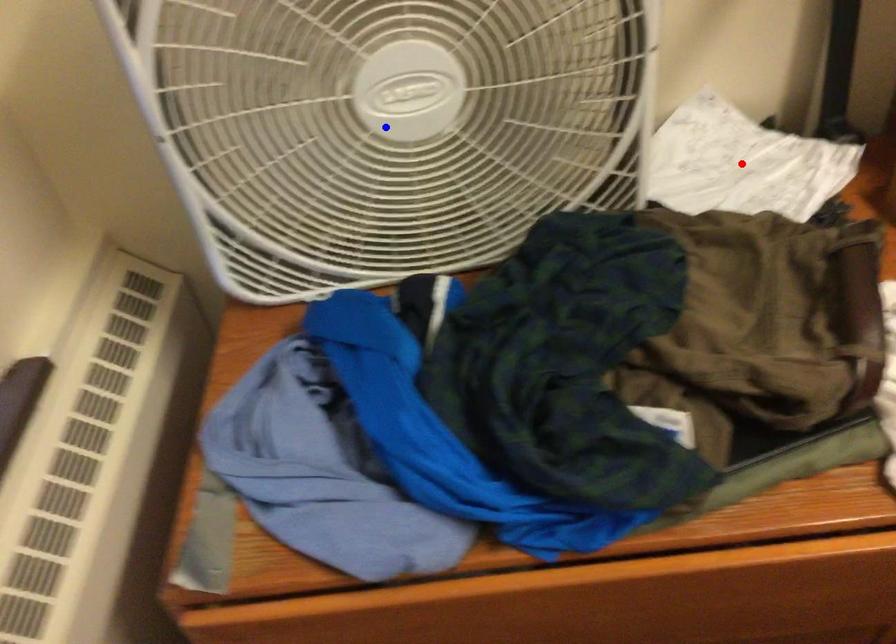
Question: Which of the two points in the image is closer to the camera?

Choices:
 (A) Blue point is closer.
 (B) Red point is closer.

Answer: (A)